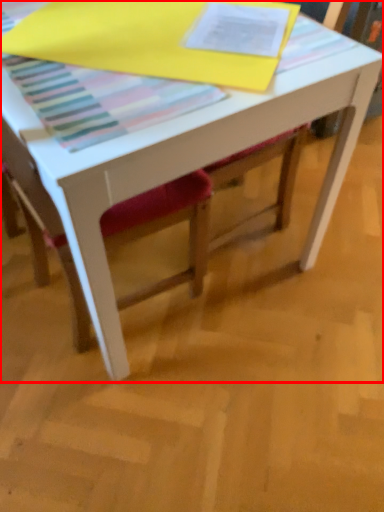
Question: From the image's perspective, where is table (annotated by the red box) located in relation to chair in the image?

Choices:
 (A) above
 (B) below

Answer: (A)